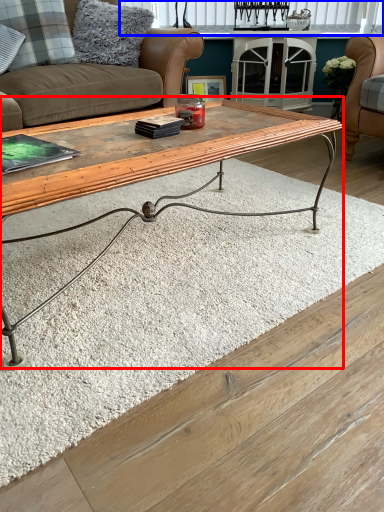
Question: Which object is closer to the camera taking this photo, coffee table (highlighted by a red box) or window (highlighted by a blue box)?

Choices:
 (A) coffee table
 (B) window

Answer: (A)